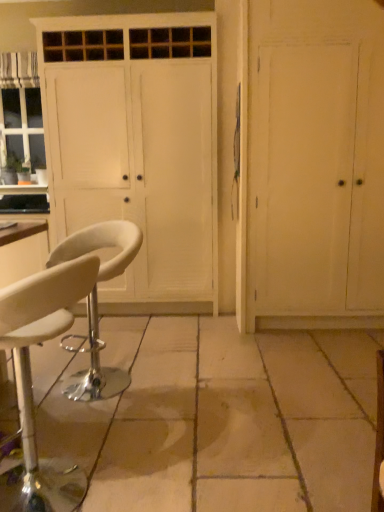
You are a GUI agent. You are given a task and a screenshot of the screen. Output one action in this format:
    pyautogui.click(x=<x>, y=<y>)
    Task: Click on the vacant space that's between white leather stool at lower left, the second chair from the back, and white wood door at right
    The image size is (384, 512).
    Given the screenshot: What is the action you would take?
    pyautogui.click(x=230, y=386)